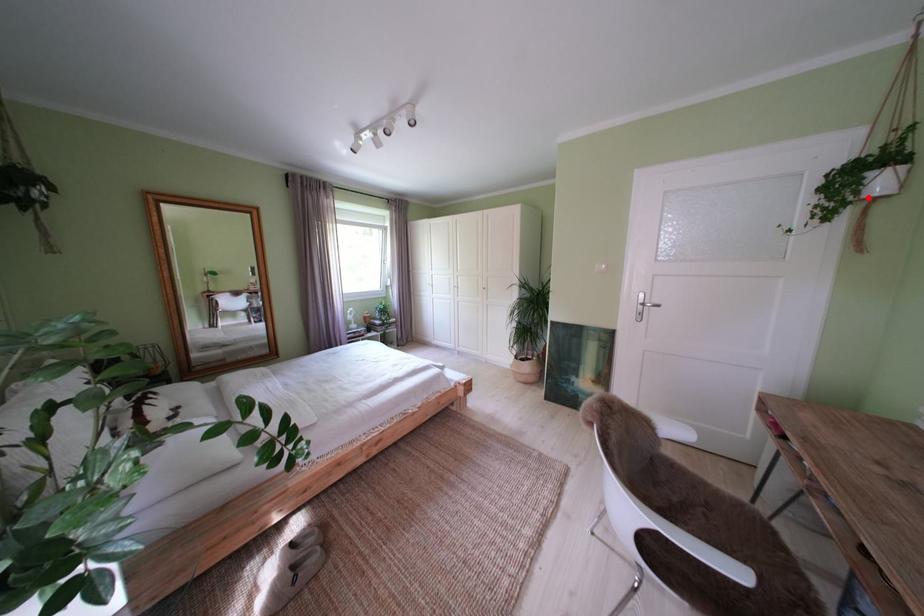
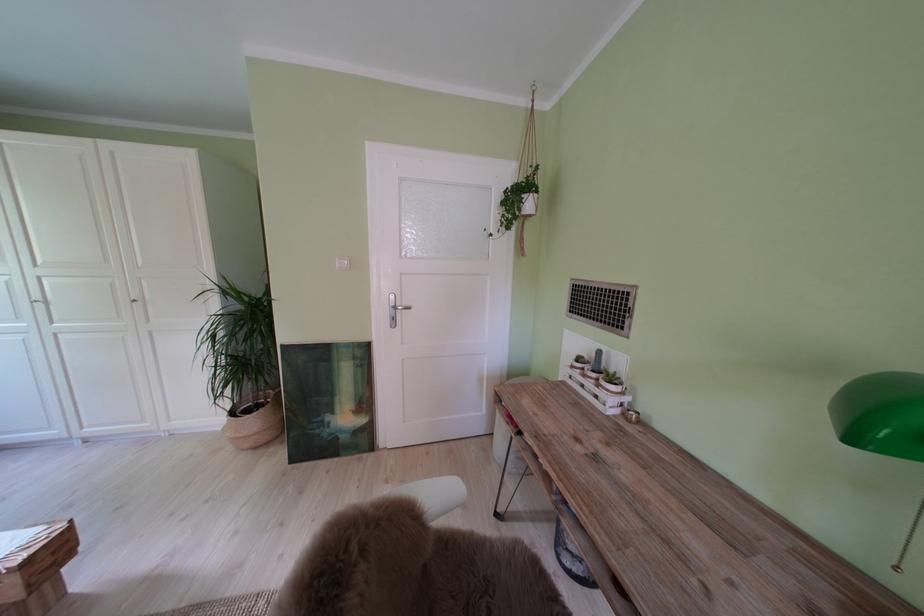
Find the pixel in the second image that matches the highlighted location in the first image.

(530, 215)